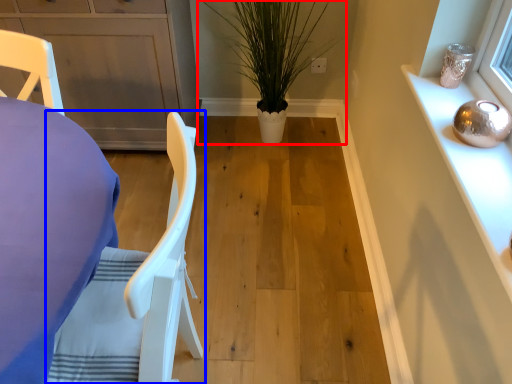
Question: Which of the following is the farthest to the observer, houseplant (highlighted by a red box) or chair (highlighted by a blue box)?

Choices:
 (A) houseplant
 (B) chair

Answer: (A)